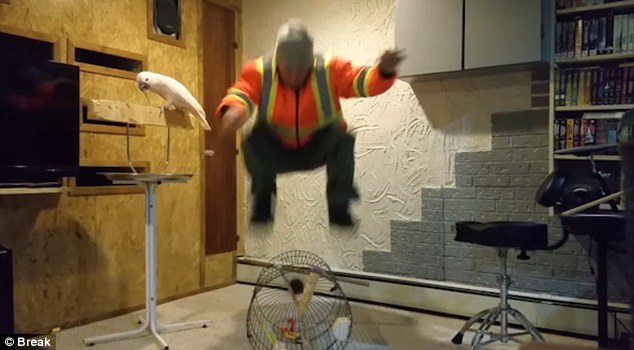
Find the location of a particular element. The width and height of the screenshot is (634, 350). metal stool bottom is located at coordinates (503, 305).